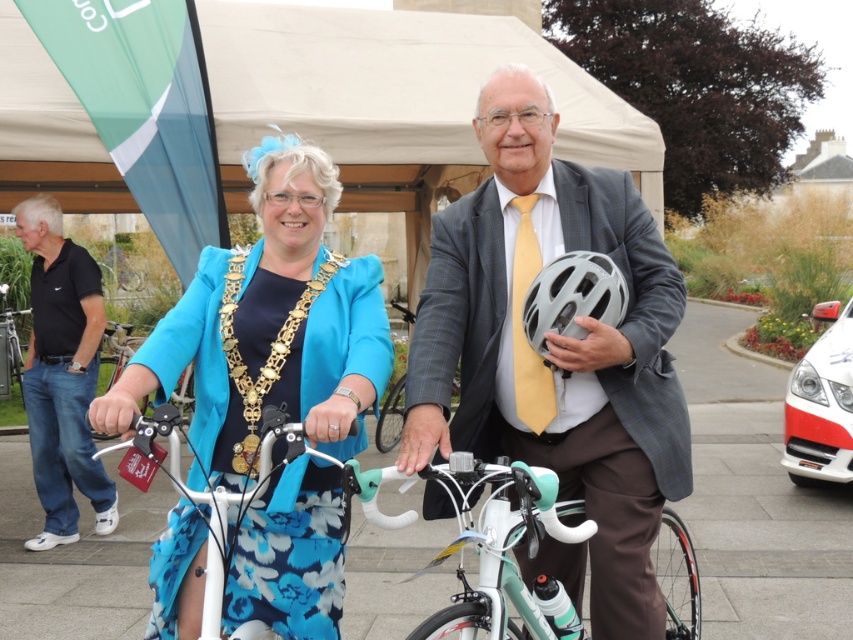
Question: Is matte gray helmet at center to the right of white glossy bicycle at center from the viewer's perspective?

Choices:
 (A) yes
 (B) no

Answer: (A)

Question: Among these objects, which one is farthest from the camera?

Choices:
 (A) matte gray helmet at center
 (B) white glossy bicycle at center
 (C) teal glossy bicycle at center
 (D) black cotton polo shirt at left

Answer: (D)

Question: Which object is closer to the camera taking this photo?

Choices:
 (A) teal glossy bicycle at center
 (B) silver metallic bicycle at left
 (C) teal fabric jacket at center

Answer: (A)

Question: Is matte blue jacket at center smaller than teal glossy bicycle at center?

Choices:
 (A) yes
 (B) no

Answer: (B)

Question: Is matte gray helmet at center positioned at the back of matte gray bicycle helmet at center?

Choices:
 (A) yes
 (B) no

Answer: (B)

Question: Which point is closer to the camera taking this photo?

Choices:
 (A) (566, 262)
 (B) (16, 353)
 (C) (683, 529)
 (D) (76, 368)

Answer: (A)